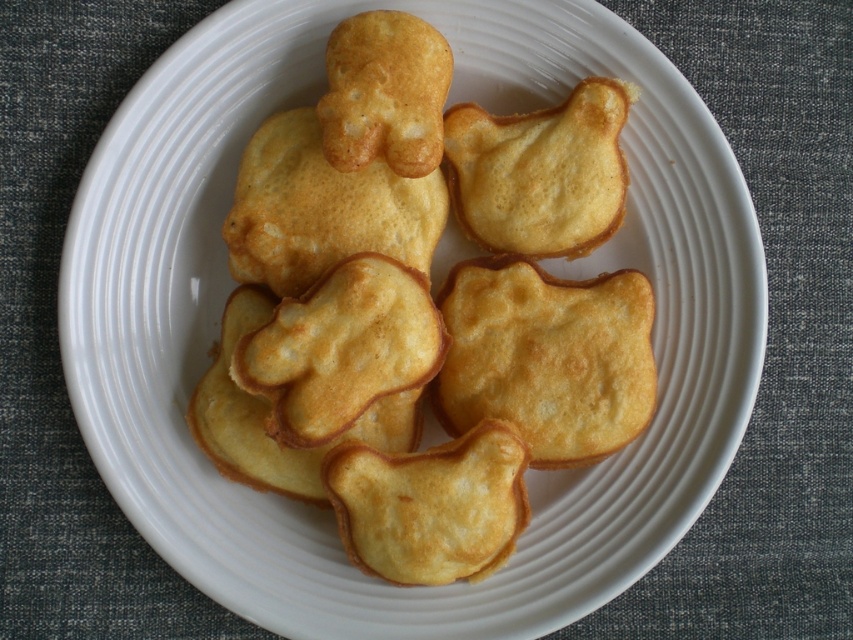
Does golden crispy bunny at center have a smaller size compared to golden-brown crispy cat at center?

Actually, golden crispy bunny at center might be larger than golden-brown crispy cat at center.

Who is higher up, golden crispy bunny at center or golden-brown crispy cat at center?

golden-brown crispy cat at center

The height and width of the screenshot is (640, 853). Describe the element at coordinates (341, 348) in the screenshot. I see `golden crispy bunny at center` at that location.

Locate an element on the screen. The width and height of the screenshot is (853, 640). golden crispy bunny at center is located at coordinates (341, 348).

Does golden crispy pastry at center appear on the left side of golden crispy cat at center?

Yes, golden crispy pastry at center is to the left of golden crispy cat at center.

Who is more distant from viewer, (311,296) or (647,376)?

The point (647,376) is behind.

Locate an element on the screen. This screenshot has height=640, width=853. golden crispy pastry at center is located at coordinates (x=422, y=314).

Does golden crispy cat at center have a lesser width compared to golden crispy bunny at center?

Incorrect, golden crispy cat at center's width is not less than golden crispy bunny at center's.

Image resolution: width=853 pixels, height=640 pixels. I want to click on golden crispy cat at center, so click(x=547, y=356).